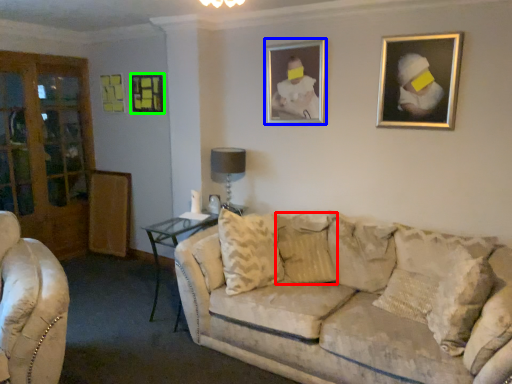
Question: Considering the real-world distances, which object is closest to pillow (highlighted by a red box)? picture frame (highlighted by a blue box) or picture frame (highlighted by a green box).

Choices:
 (A) picture frame
 (B) picture frame

Answer: (A)